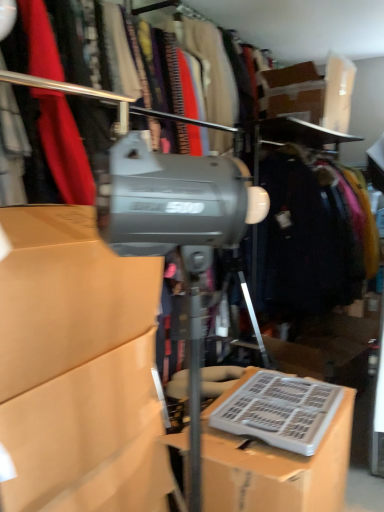
Question: Is cardboard box at center, which appears as the first box when viewed from the right, at the right side of matte gray tripod at center?

Choices:
 (A) no
 (B) yes

Answer: (B)

Question: Considering the relative positions of cardboard box at center, which appears as the first box when viewed from the right, and matte gray tripod at center in the image provided, is cardboard box at center, which appears as the first box when viewed from the right, to the left of matte gray tripod at center from the viewer's perspective?

Choices:
 (A) no
 (B) yes

Answer: (A)

Question: From a real-world perspective, is cardboard box at center, which is the second box from left to right, below matte gray tripod at center?

Choices:
 (A) yes
 (B) no

Answer: (A)

Question: Can we say cardboard box at center, which is the second box from left to right, lies outside matte gray tripod at center?

Choices:
 (A) yes
 (B) no

Answer: (A)

Question: Does cardboard box at center, which appears as the first box when viewed from the right, turn towards matte gray tripod at center?

Choices:
 (A) yes
 (B) no

Answer: (B)

Question: Considering the relative sizes of cardboard box at center, which appears as the first box when viewed from the right, and matte gray tripod at center in the image provided, is cardboard box at center, which appears as the first box when viewed from the right, smaller than matte gray tripod at center?

Choices:
 (A) no
 (B) yes

Answer: (B)

Question: Considering the relative positions of matte cardboard box at center, which is the second box from right to left, and white plastic keyboard at lower right in the image provided, is matte cardboard box at center, which is the second box from right to left, in front of white plastic keyboard at lower right?

Choices:
 (A) no
 (B) yes

Answer: (B)

Question: Considering the relative positions of matte cardboard box at center, which is counted as the first box, starting from the left, and white plastic keyboard at lower right in the image provided, is matte cardboard box at center, which is counted as the first box, starting from the left, to the left of white plastic keyboard at lower right from the viewer's perspective?

Choices:
 (A) yes
 (B) no

Answer: (A)

Question: From the image's perspective, is matte cardboard box at center, which is counted as the first box, starting from the left, above white plastic keyboard at lower right?

Choices:
 (A) no
 (B) yes

Answer: (B)

Question: Does matte cardboard box at center, which is the second box from right to left, have a greater width compared to white plastic keyboard at lower right?

Choices:
 (A) yes
 (B) no

Answer: (B)

Question: Can you confirm if matte cardboard box at center, which is the second box from right to left, is bigger than white plastic keyboard at lower right?

Choices:
 (A) yes
 (B) no

Answer: (A)

Question: Is matte cardboard box at center, which is counted as the first box, starting from the left, thinner than white plastic keyboard at lower right?

Choices:
 (A) no
 (B) yes

Answer: (B)

Question: From a real-world perspective, is dark blue fabric coat at right below matte cardboard box at center, which is counted as the first box, starting from the left?

Choices:
 (A) yes
 (B) no

Answer: (B)